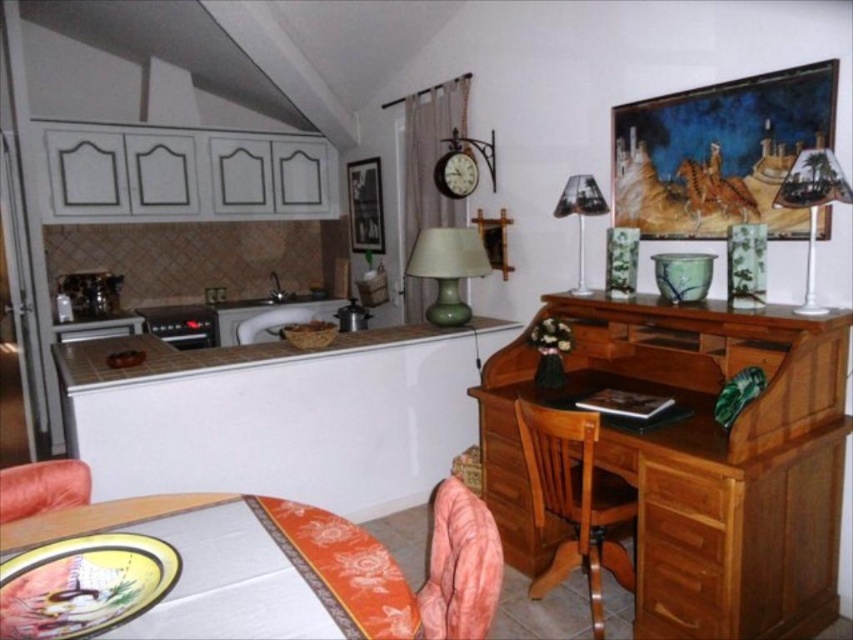
Question: Which of the following is the closest to the observer?

Choices:
 (A) white glossy table at lower left
 (B) wooden chair at lower center
 (C) leather-like orange armchair at lower left
 (D) green marble table lamp at upper right

Answer: (A)

Question: Based on their relative distances, which object is nearer to the leather-like orange armchair at lower left?

Choices:
 (A) white glossy table at lower left
 (B) brown fabric armchair at left

Answer: (A)

Question: Can you confirm if wooden drawer at right is wider than green marble table lamp at upper right?

Choices:
 (A) no
 (B) yes

Answer: (A)

Question: Can you confirm if wooden drawer at right is positioned below brown fabric armchair at left?

Choices:
 (A) yes
 (B) no

Answer: (A)

Question: Can you confirm if wooden drawer at right is positioned to the right of brown fabric armchair at left?

Choices:
 (A) no
 (B) yes

Answer: (B)

Question: Which object is farther from the camera taking this photo?

Choices:
 (A) brown fabric armchair at left
 (B) white glossy table at lower left

Answer: (A)